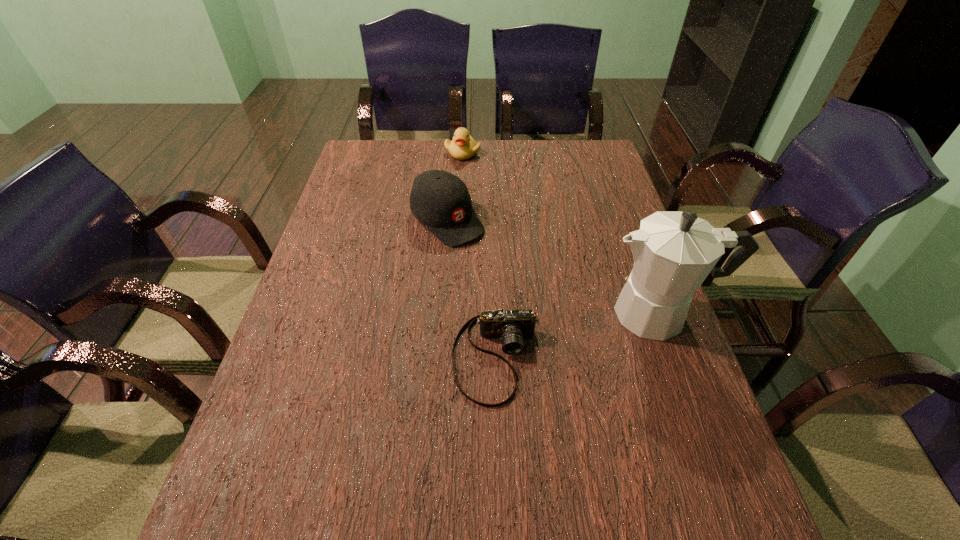
Image resolution: width=960 pixels, height=540 pixels. I want to click on free spot between the camera and the third shortest object, so click(472, 288).

Identify which object is the third closest to the farthest object. Please provide its 2D coordinates. Your answer should be formatted as a tuple, i.e. [(x, y)], where the tuple contains the x and y coordinates of a point satisfying the conditions above.

[(512, 326)]

What are the coordinates of `the second closest object to the baseball cap` in the screenshot? It's located at (512, 326).

The height and width of the screenshot is (540, 960). Find the location of `free space that satisfies the following two spatial constraints: 1. on the front side of the tallest object; 2. at the spout of the second farthest object`. free space that satisfies the following two spatial constraints: 1. on the front side of the tallest object; 2. at the spout of the second farthest object is located at coordinates (440, 313).

The image size is (960, 540). In order to click on vacant region that satisfies the following two spatial constraints: 1. on the back side of the third tallest object; 2. on the right side of the second tallest object in this screenshot , I will do `click(453, 153)`.